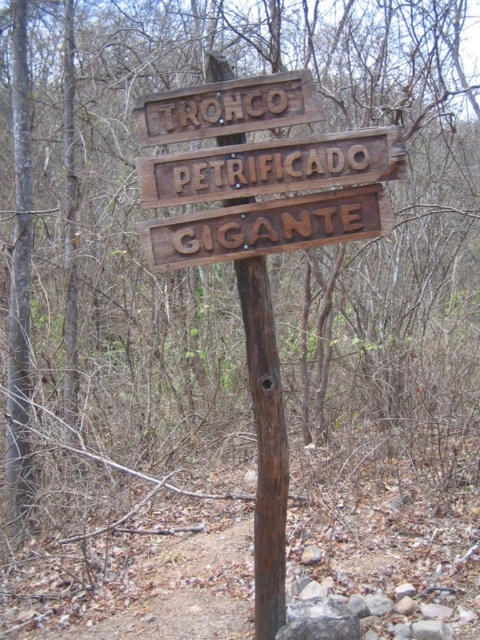
You are a hiker who wants to read both the brown wooden sign at center and the brown wooden sign at upper center. Which one should you look at first to read them in the correct order from top to bottom?

The brown wooden sign at upper center should be read first because it is positioned above the brown wooden sign at center, following the top to bottom reading order.